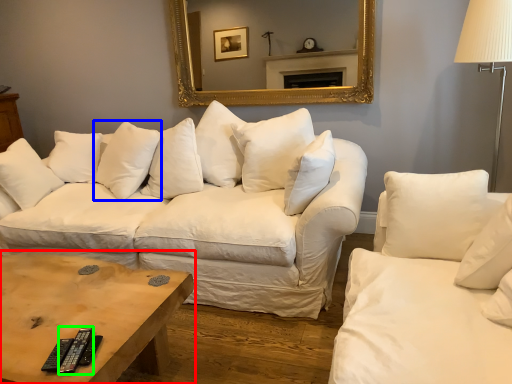
Question: Which object is the closest to the coffee table (highlighted by a red box)? Choose among these: pillow (highlighted by a blue box) or remote (highlighted by a green box).

Choices:
 (A) pillow
 (B) remote

Answer: (B)